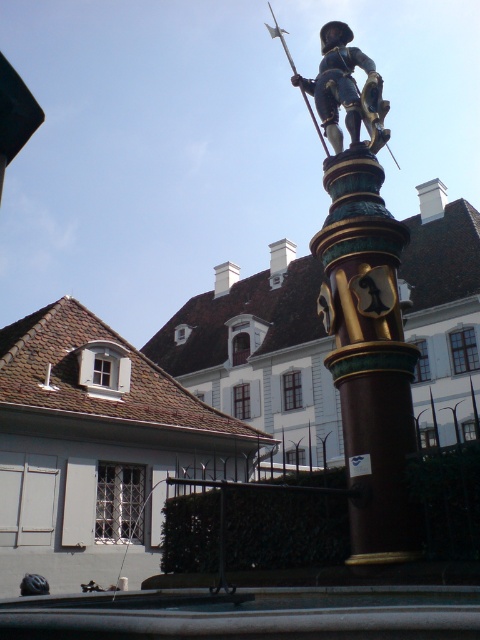
You are an architect planning to place a new sculpture in the square. The sculpture is 3 meters tall. The polished bronze statue at center is currently occupying the central area. Can the gold polished pillar at center be moved to accommodate the new sculpture without removing the statue?

The gold polished pillar at center has a smaller size compared to the polished bronze statue at center. Since the pillar is smaller, it could potentially be moved aside to make space for the new 3m sculpture while keeping the statue in place.

You are an architect analyzing the historical scene. You notice a point at coordinates (x=368, y=353). Based on the scene description, what significant structure does this point likely indicate?

The point at coordinates (x=368, y=353) corresponds to the gold polished pillar at center, which is part of the prominent statue of a soldier standing atop a tall, ornate column described in the scene.